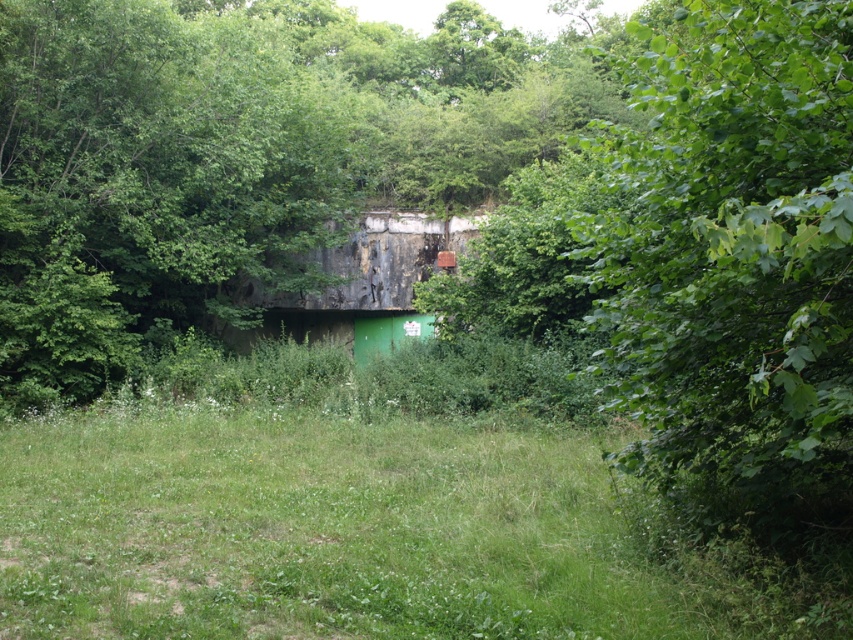
You are standing in the middle of the green grass at center and want to walk towards the green leafy tree at right. Which direction should you head?

You should head to the right because the green leafy tree at right is located to the right of the green grass at center.

You are a gardener assessing the growth of plants in the scene. Which object, the green grass at center or the green leafy tree at right, is shorter?

The green grass at center is shorter than the green leafy tree at right.

You are standing in the natural setting described. You want to place a picnic blanket on the green grass at center. However, you notice the green leafy tree at right. Will the tree cast a shadow over the grass where you want to place the blanket?

The green grass at center is positioned under green leafy tree at right, so yes, the tree will cast a shadow over the grass where you want to place the blanket.